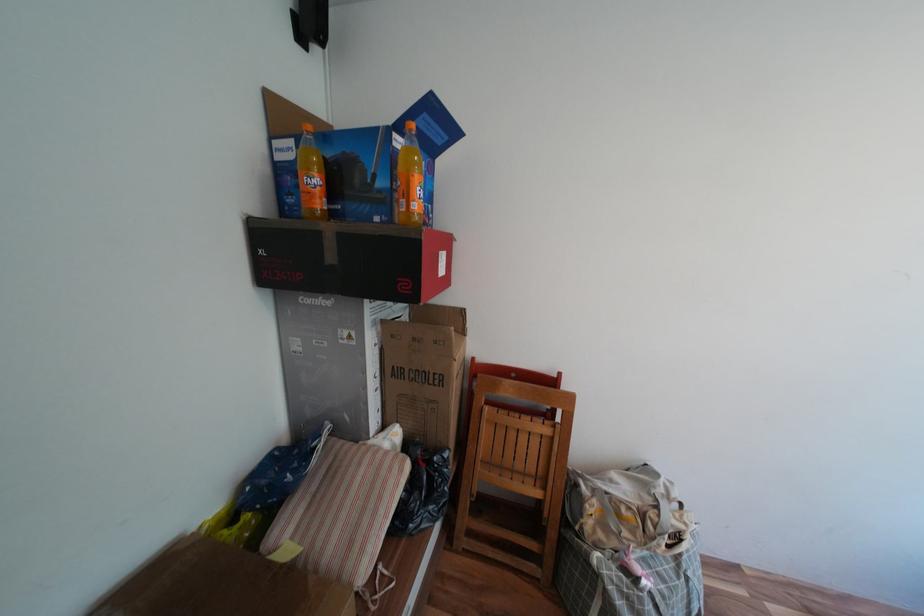
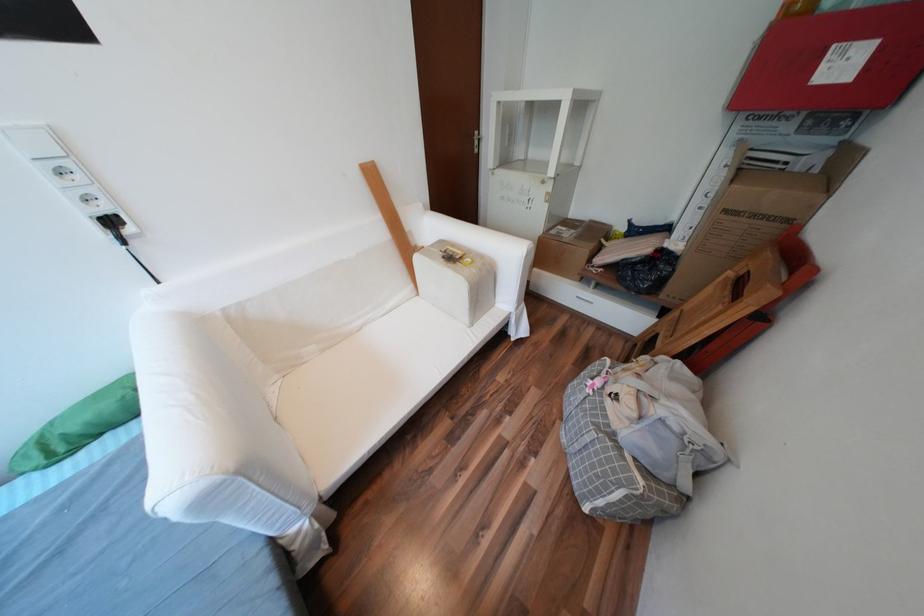
Locate, in the second image, the point that corresponds to point (629, 580) in the first image.

(602, 371)